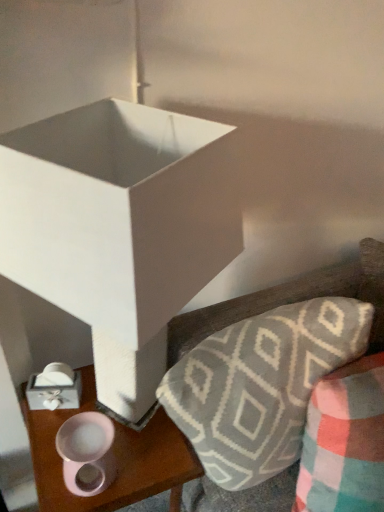
Question: Is point (122, 474) closer or farther from the camera than point (362, 502)?

Choices:
 (A) closer
 (B) farther

Answer: (B)

Question: Considering their positions, is pink glossy mug at lower left located in front of or behind plush gray and white geometric-patterned throw pillow at lower right?

Choices:
 (A) behind
 (B) front

Answer: (A)

Question: Based on their relative distances, which object is farther from the plush gray and white geometric-patterned throw pillow at lower right?

Choices:
 (A) pink matte candle holder at lower left
 (B) white matte box at center
 (C) textured gray pillow at upper right
 (D) pink glossy mug at lower left

Answer: (B)

Question: Estimate the real-world distances between objects in this image. Which object is farther from the pink glossy mug at lower left?

Choices:
 (A) textured gray pillow at upper right
 (B) white matte box at center
 (C) plush gray and white geometric-patterned throw pillow at lower right
 (D) pink matte candle holder at lower left

Answer: (B)